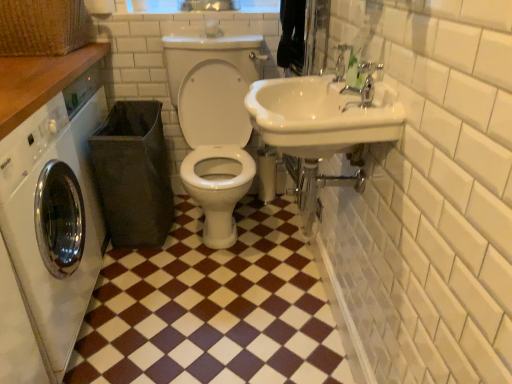
At what (x,y) coordinates should I click in order to perform the action: click on vacant area on top of brown glossy tile at lower left (from a real-world perspective). Please return your answer as a coordinate pair (x, y). Looking at the image, I should click on (207, 280).